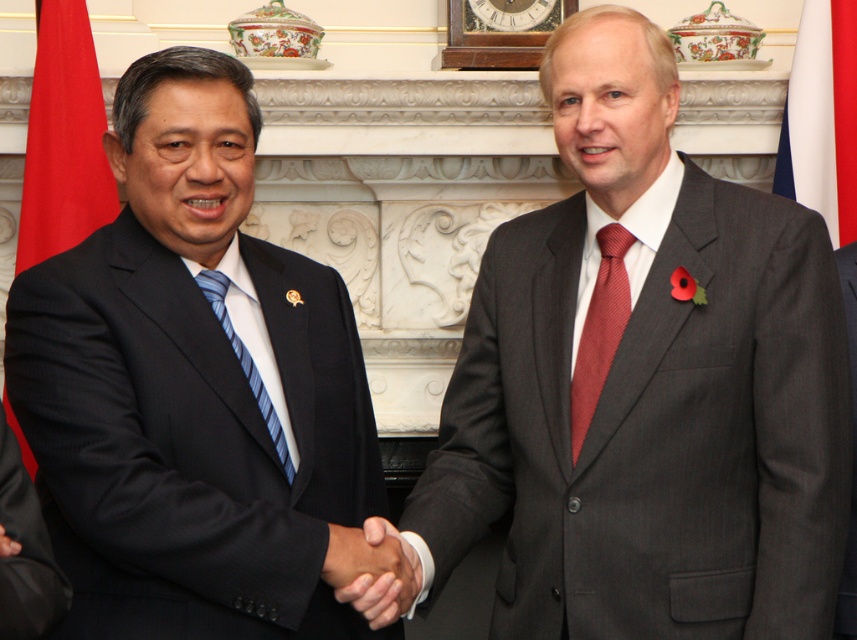
Question: Which object is closer to the camera taking this photo?

Choices:
 (A) black matte suit at left
 (B) blue striped tie at center
 (C) white fabric flag at right
 (D) black smooth hand at center

Answer: (A)

Question: Is red fabric flag at left thinner than blue striped tie at center?

Choices:
 (A) yes
 (B) no

Answer: (B)

Question: Is white fabric flag at right to the left of red silk tie at center from the viewer's perspective?

Choices:
 (A) no
 (B) yes

Answer: (A)

Question: Which point is farther from the camera taking this photo?

Choices:
 (A) (572, 380)
 (B) (794, 109)
 (C) (334, 588)

Answer: (B)

Question: Which of the following is the closest to the observer?

Choices:
 (A) white fabric flag at right
 (B) red silk tie at center

Answer: (B)

Question: Is black smooth hand at center further to the viewer compared to blue striped tie at center?

Choices:
 (A) no
 (B) yes

Answer: (A)